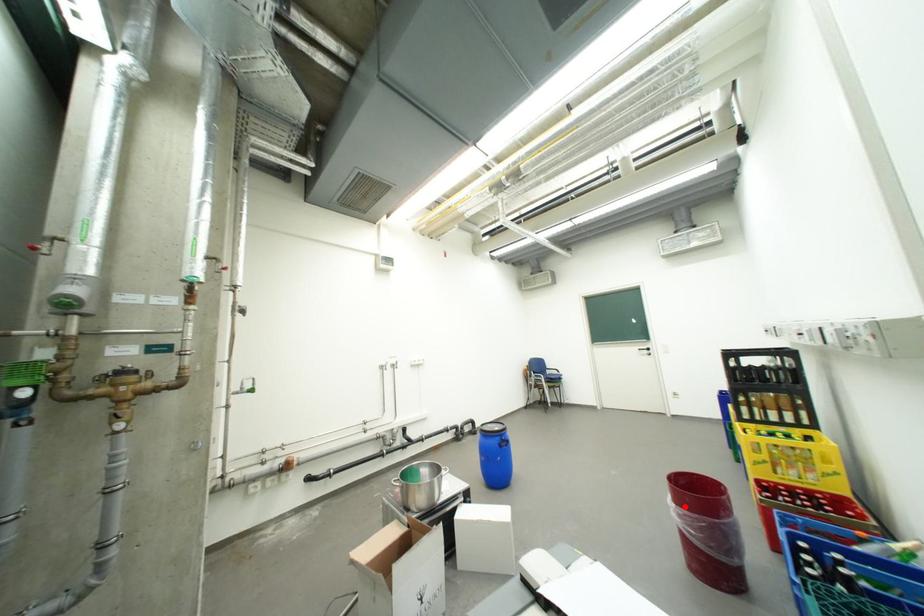
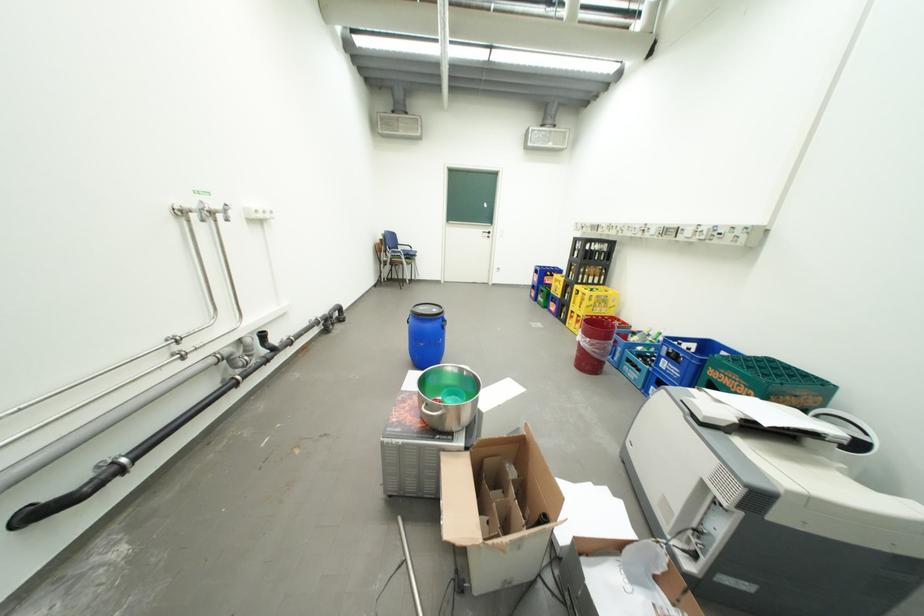
The point at the highlighted location is marked in the first image. Where is the corresponding point in the second image?

(599, 341)